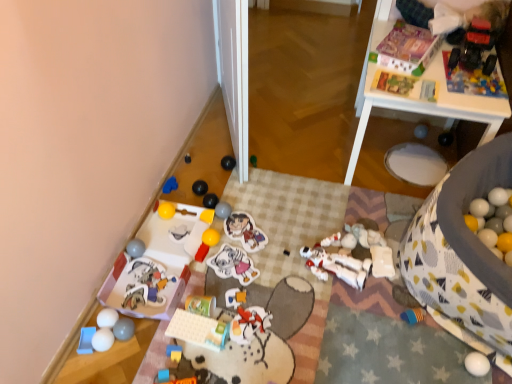
Question: Does shiny black ball at center, marked as the eighteenth toy in a right-to-left arrangement, have a lesser height compared to green matte ball at center, which is the 6th toy in right-to-left order?

Choices:
 (A) yes
 (B) no

Answer: (A)

Question: Is shiny black ball at center, marked as the eighteenth toy in a right-to-left arrangement, not inside green matte ball at center, which is the 6th toy in right-to-left order?

Choices:
 (A) no
 (B) yes

Answer: (B)

Question: From a real-world perspective, is shiny black ball at center, which is the 9th toy in left-to-right order, physically below green matte ball at center, which is the 6th toy in right-to-left order?

Choices:
 (A) yes
 (B) no

Answer: (A)

Question: Does shiny black ball at center, marked as the eighteenth toy in a right-to-left arrangement, appear on the left side of green matte ball at center, acting as the 21th toy starting from the left?

Choices:
 (A) no
 (B) yes

Answer: (B)

Question: Considering the relative sizes of shiny black ball at center, which is the 9th toy in left-to-right order, and green matte ball at center, acting as the 21th toy starting from the left, in the image provided, is shiny black ball at center, which is the 9th toy in left-to-right order, smaller than green matte ball at center, acting as the 21th toy starting from the left,?

Choices:
 (A) no
 (B) yes

Answer: (B)

Question: From a real-world perspective, is shiny black ball at center, marked as the eighteenth toy in a right-to-left arrangement, physically above green matte ball at center, which is the 6th toy in right-to-left order?

Choices:
 (A) yes
 (B) no

Answer: (B)

Question: Is yellow matte ball at center, which appears as the thirteenth toy when viewed from the left, further to the viewer compared to matte cardboard box at upper right, which ranks as the 3th toy in right-to-left order?

Choices:
 (A) no
 (B) yes

Answer: (B)

Question: Is yellow matte ball at center, which appears as the thirteenth toy when viewed from the left, not close to matte cardboard box at upper right, which is the 24th toy in left-to-right order?

Choices:
 (A) yes
 (B) no

Answer: (A)

Question: Does yellow matte ball at center, which appears as the thirteenth toy when viewed from the left, have a greater height compared to matte cardboard box at upper right, which ranks as the 3th toy in right-to-left order?

Choices:
 (A) yes
 (B) no

Answer: (B)

Question: Is yellow matte ball at center, which appears as the thirteenth toy when viewed from the left, smaller than matte cardboard box at upper right, which ranks as the 3th toy in right-to-left order?

Choices:
 (A) no
 (B) yes

Answer: (B)

Question: Could you tell me if yellow matte ball at center, which appears as the thirteenth toy when viewed from the left, is facing matte cardboard box at upper right, which ranks as the 3th toy in right-to-left order?

Choices:
 (A) yes
 (B) no

Answer: (B)

Question: Is yellow matte ball at center, which appears as the thirteenth toy when viewed from the left, to the left of matte cardboard box at upper right, which ranks as the 3th toy in right-to-left order, from the viewer's perspective?

Choices:
 (A) no
 (B) yes

Answer: (B)

Question: From a real-world perspective, is black rubber ball at center, the 12th toy from the left, over white glossy table at upper right?

Choices:
 (A) no
 (B) yes

Answer: (A)